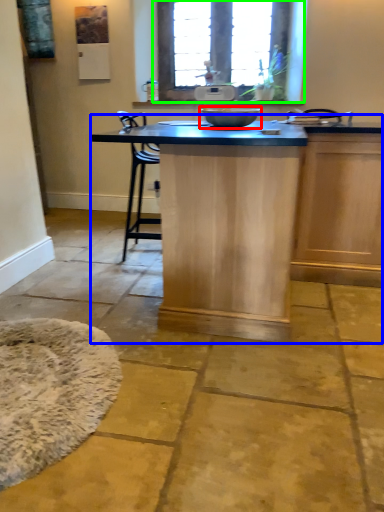
Question: Which is nearer to the mixing bowl (highlighted by a red box)? table (highlighted by a blue box) or window (highlighted by a green box).

Choices:
 (A) table
 (B) window

Answer: (A)